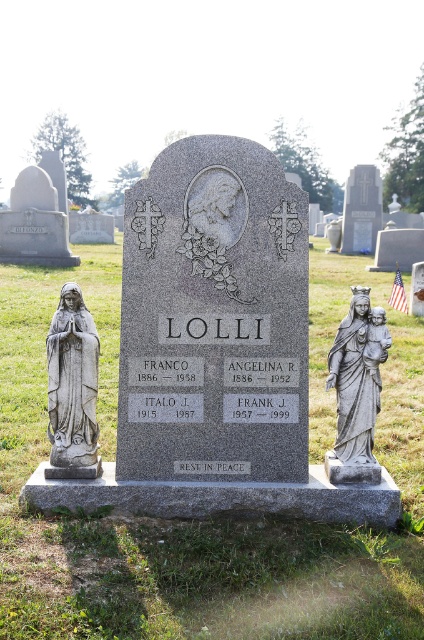
Question: Is gray stone statue at left to the left of gray stone statue of mary holding baby at right from the viewer's perspective?

Choices:
 (A) yes
 (B) no

Answer: (A)

Question: Which point is closer to the camera?

Choices:
 (A) (345, 344)
 (B) (69, 305)

Answer: (B)

Question: Is gray stone statue at left to the right of gray stone statue of mary holding baby at right from the viewer's perspective?

Choices:
 (A) no
 (B) yes

Answer: (A)

Question: Which point is closer to the camera?

Choices:
 (A) (342, 381)
 (B) (81, 422)

Answer: (B)

Question: Is gray stone statue at left positioned at the back of gray stone statue of mary holding baby at right?

Choices:
 (A) no
 (B) yes

Answer: (B)

Question: Which point is closer to the camera taking this photo?

Choices:
 (A) (86, 323)
 (B) (342, 456)

Answer: (A)